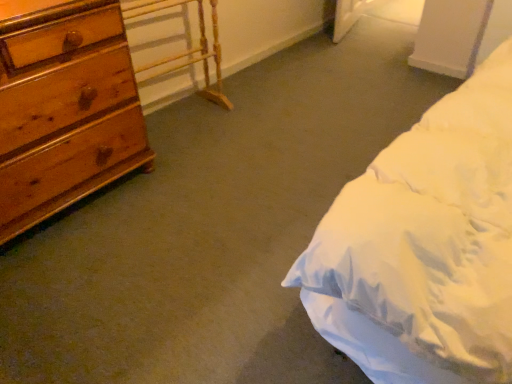
Where is `wooden table at left`? The image size is (512, 384). wooden table at left is located at coordinates (188, 49).

What do you see at coordinates (188, 49) in the screenshot? I see `wooden table at left` at bounding box center [188, 49].

Identify the location of wooden chest of drawers at left. Image resolution: width=512 pixels, height=384 pixels. (65, 111).

This screenshot has height=384, width=512. What do you see at coordinates (65, 111) in the screenshot?
I see `wooden chest of drawers at left` at bounding box center [65, 111].

Image resolution: width=512 pixels, height=384 pixels. Find the location of `wooden table at left`. wooden table at left is located at coordinates (188, 49).

Considering the relative positions of wooden chest of drawers at left and wooden table at left in the image provided, is wooden chest of drawers at left to the left of wooden table at left from the viewer's perspective?

Indeed, wooden chest of drawers at left is positioned on the left side of wooden table at left.

Is wooden chest of drawers at left in front of or behind wooden table at left in the image?

Clearly, wooden chest of drawers at left is in front of wooden table at left.

Considering the points (30, 34) and (215, 103), which point is in front, point (30, 34) or point (215, 103)?

The point (30, 34) is in front.

From the image's perspective, between wooden chest of drawers at left and wooden table at left, who is located below?

wooden chest of drawers at left, from the image's perspective.

From a real-world perspective, is wooden chest of drawers at left physically above wooden table at left?

Yes.

Which object is thinner, wooden chest of drawers at left or wooden table at left?

wooden table at left.

Is wooden chest of drawers at left shorter than wooden table at left?

No, wooden chest of drawers at left is not shorter than wooden table at left.

Between wooden chest of drawers at left and wooden table at left, which one has larger size?

Bigger between the two is wooden chest of drawers at left.

Is wooden chest of drawers at left positioned beyond the bounds of wooden table at left?

Absolutely, wooden chest of drawers at left is external to wooden table at left.

Is wooden chest of drawers at left far from wooden table at left?

No, there isn't a large distance between wooden chest of drawers at left and wooden table at left.

Is wooden chest of drawers at left oriented towards wooden table at left?

No.

How different are the orientations of wooden chest of drawers at left and wooden table at left in degrees?

5.45 degrees.

Image resolution: width=512 pixels, height=384 pixels. Find the location of `the chest of drawers below the wooden table at left (from the image's perspective)`. the chest of drawers below the wooden table at left (from the image's perspective) is located at coordinates (65, 111).

Which is more to the right, wooden table at left or wooden chest of drawers at left?

wooden table at left.

From the picture: In the image, is wooden table at left positioned in front of or behind wooden chest of drawers at left?

In the image, wooden table at left appears behind wooden chest of drawers at left.

Is point (215, 58) in front of point (3, 181)?

No, it is behind (3, 181).

From the image's perspective, which one is positioned higher, wooden table at left or wooden chest of drawers at left?

wooden table at left appears higher in the image.

From a real-world perspective, which object rests below the other?

wooden table at left is physically lower.

Looking at their sizes, would you say wooden table at left is wider or thinner than wooden chest of drawers at left?

wooden table at left is thinner than wooden chest of drawers at left.

Considering the sizes of wooden table at left and wooden chest of drawers at left in the image, is wooden table at left taller or shorter than wooden chest of drawers at left?

In the image, wooden table at left appears to be shorter than wooden chest of drawers at left.

Considering the sizes of wooden table at left and wooden chest of drawers at left in the image, is wooden table at left bigger or smaller than wooden chest of drawers at left?

Clearly, wooden table at left is smaller in size than wooden chest of drawers at left.

Is wooden chest of drawers at left located within wooden table at left?

That's incorrect, wooden chest of drawers at left is not inside wooden table at left.

Are wooden table at left and wooden chest of drawers at left beside each other?

No.

Is wooden table at left oriented away from wooden chest of drawers at left?

No, wooden table at left is not facing away from wooden chest of drawers at left.

Measure the distance between wooden table at left and wooden chest of drawers at left.

wooden table at left is 26.70 inches from wooden chest of drawers at left.

Where is `chest of drawers below the wooden table at left (from the image's perspective)`? chest of drawers below the wooden table at left (from the image's perspective) is located at coordinates (65, 111).

Image resolution: width=512 pixels, height=384 pixels. In the image, there is a wooden chest of drawers at left. What are the coordinates of `table above it (from the image's perspective)` in the screenshot? It's located at (188, 49).

The image size is (512, 384). In order to click on table to the right of wooden chest of drawers at left in this screenshot , I will do `click(188, 49)`.